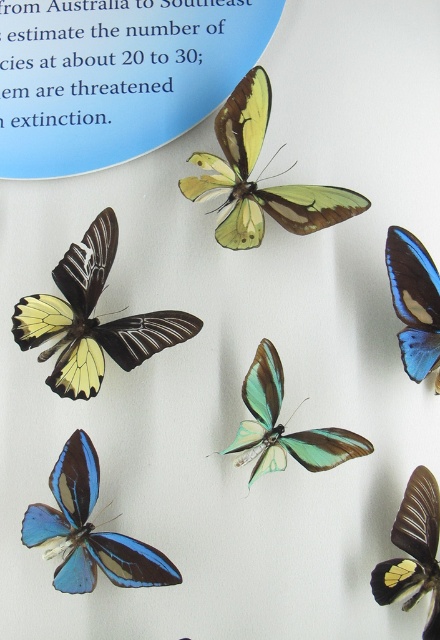
You are an entomologist examining the butterflies displayed on a white background. You need to determine which butterfly has a greater height between the matte yellow butterfly at left and the blue glossy butterfly at upper right. Which one is taller?

The matte yellow butterfly at left is much taller than the blue glossy butterfly at upper right according to the description.

You are an entomologist examining the butterfly specimens. You need to determine which butterfly has a larger wingspan between the blue translucent butterfly at lower left and the translucent green butterfly at center. Based on the display, which one should you measure first?

The blue translucent butterfly at lower left has a larger size compared to the translucent green butterfly at center, so you should measure the blue translucent butterfly at lower left first to confirm its wingspan.

Looking at this image, which butterfly is located at the coordinates point (x=91, y=317)?

The matte yellow butterfly at left is located at point (x=91, y=317).